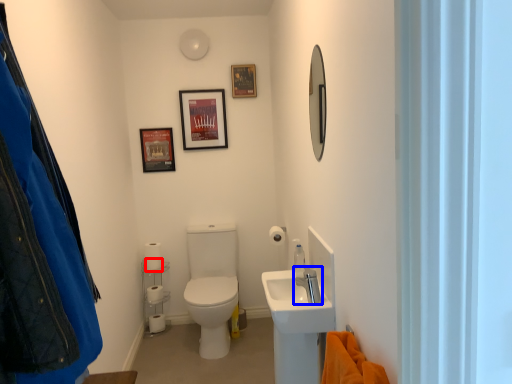
Question: Among these objects, which one is nearest to the camera, toilet paper (highlighted by a red box) or tap (highlighted by a blue box)?

Choices:
 (A) toilet paper
 (B) tap

Answer: (B)